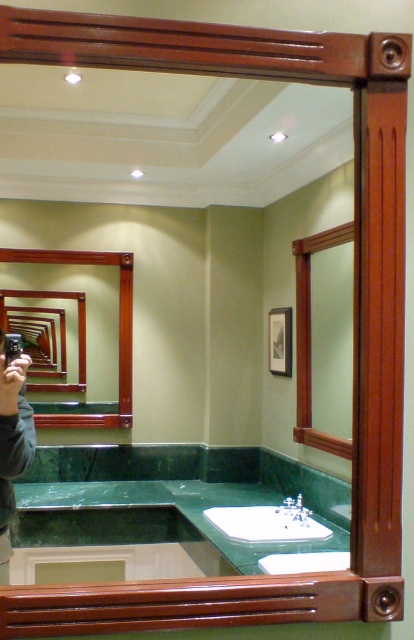
Question: Does green marble mirror at center lie behind white glossy sink at center?

Choices:
 (A) no
 (B) yes

Answer: (A)

Question: Does green marble mirror at center have a larger size compared to white glossy sink at center?

Choices:
 (A) yes
 (B) no

Answer: (A)

Question: Can you confirm if green marble mirror at center is thinner than white glossy sink at center?

Choices:
 (A) yes
 (B) no

Answer: (B)